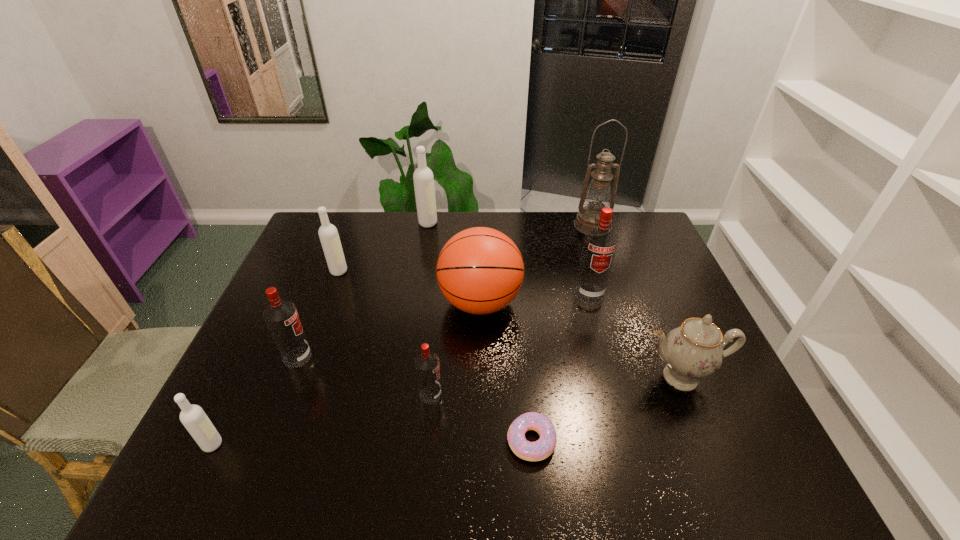
At what (x,y) coordinates should I click in order to perform the action: click on vacant area between the fourth nearest vodka and the second nearest vodka. Please return your answer as a coordinate pair (x, y). This screenshot has height=540, width=960. Looking at the image, I should click on (510, 344).

The width and height of the screenshot is (960, 540). I want to click on free spot between the leftmost object and the rightmost white vodka, so click(x=321, y=334).

Where is `free space between the nearest red vodka and the chinaware`? The height and width of the screenshot is (540, 960). free space between the nearest red vodka and the chinaware is located at coordinates (556, 386).

The width and height of the screenshot is (960, 540). In order to click on unoccupied position between the chinaware and the orange basketball in this screenshot , I will do `click(580, 340)`.

At what (x,y) coordinates should I click in order to perform the action: click on vacant region between the second vodka from right to left and the nearest white vodka. Please return your answer as a coordinate pair (x, y). Looking at the image, I should click on (322, 420).

Identify the location of free space between the pink doughnut and the chinaware. (606, 409).

This screenshot has height=540, width=960. I want to click on free space between the farthest red vodka and the fifth vodka from left to right, so click(x=510, y=344).

The width and height of the screenshot is (960, 540). I want to click on the ninth closest object to the seventh object from right to left, so click(x=194, y=419).

Choose which object is the fourth nearest neighbor to the second nearest vodka. Please provide its 2D coordinates. Your answer should be formatted as a tuple, i.e. [(x, y)], where the tuple contains the x and y coordinates of a point satisfying the conditions above.

[(194, 419)]

Identify the location of the second closest vodka to the biggest white vodka. The width and height of the screenshot is (960, 540). (600, 242).